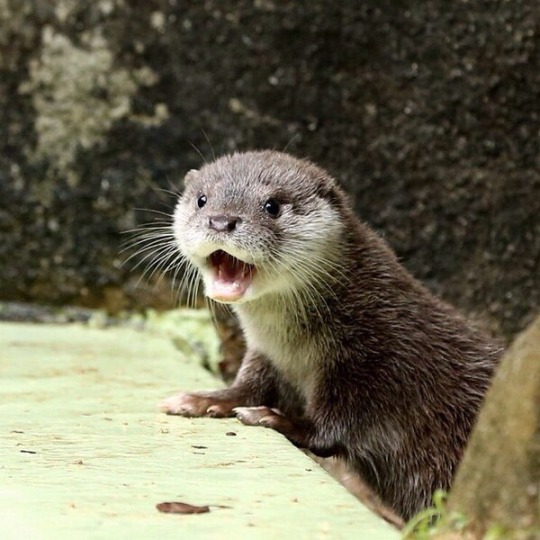
Where is `white fur`? white fur is located at coordinates (258, 316).